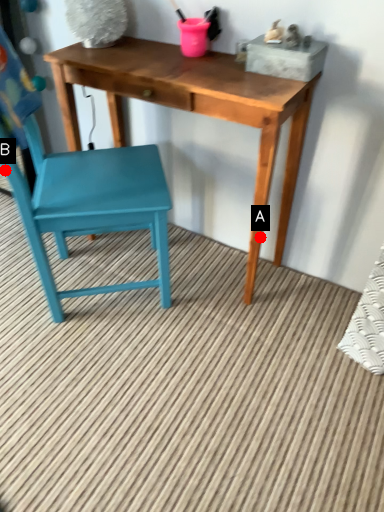
Question: Two points are circled on the image, labeled by A and B beside each circle. Among these points, which one is nearest to the camera?

Choices:
 (A) A is closer
 (B) B is closer

Answer: (B)